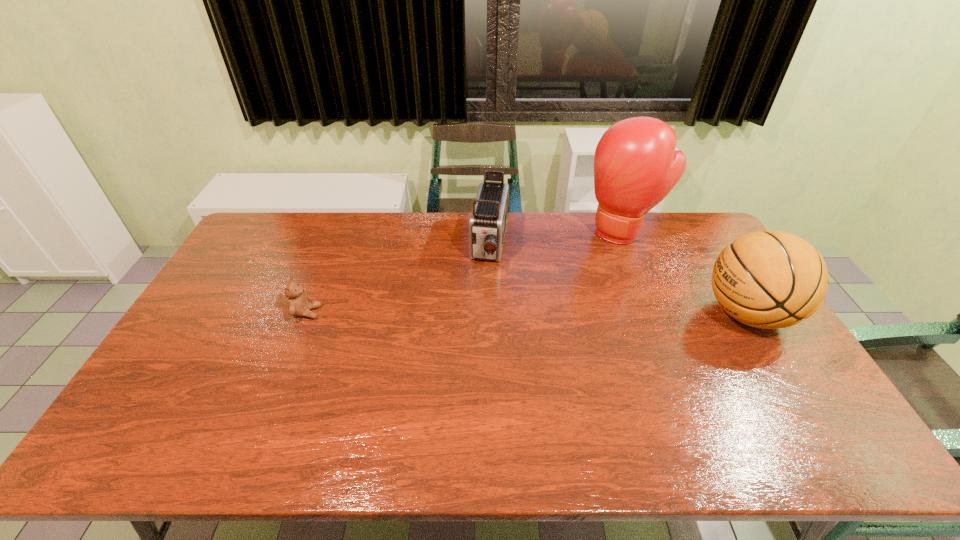
Identify the location of blank area at the near edge. (546, 400).

The height and width of the screenshot is (540, 960). In the image, there is a desktop. In order to click on vacant space at the right edge in this screenshot , I will do `click(706, 281)`.

Where is `vacant space at the near right corner`? vacant space at the near right corner is located at coordinates (767, 410).

Where is `free point between the boxing glove and the camcorder`? The width and height of the screenshot is (960, 540). free point between the boxing glove and the camcorder is located at coordinates (556, 238).

Locate an element on the screen. vacant area that lies between the basketball and the tallest object is located at coordinates (685, 273).

Find the location of a particular element. free spot between the leftmost object and the boxing glove is located at coordinates (465, 272).

Find the location of a particular element. This screenshot has width=960, height=540. free space between the teddy bear and the basketball is located at coordinates (527, 313).

Locate an element on the screen. This screenshot has width=960, height=540. unoccupied area between the boxing glove and the basketball is located at coordinates (685, 273).

Find the location of a particular element. This screenshot has height=540, width=960. vacant area that lies between the basketball and the boxing glove is located at coordinates (685, 273).

The image size is (960, 540). In order to click on free space between the boxing glove and the shortest object in this screenshot , I will do `click(465, 272)`.